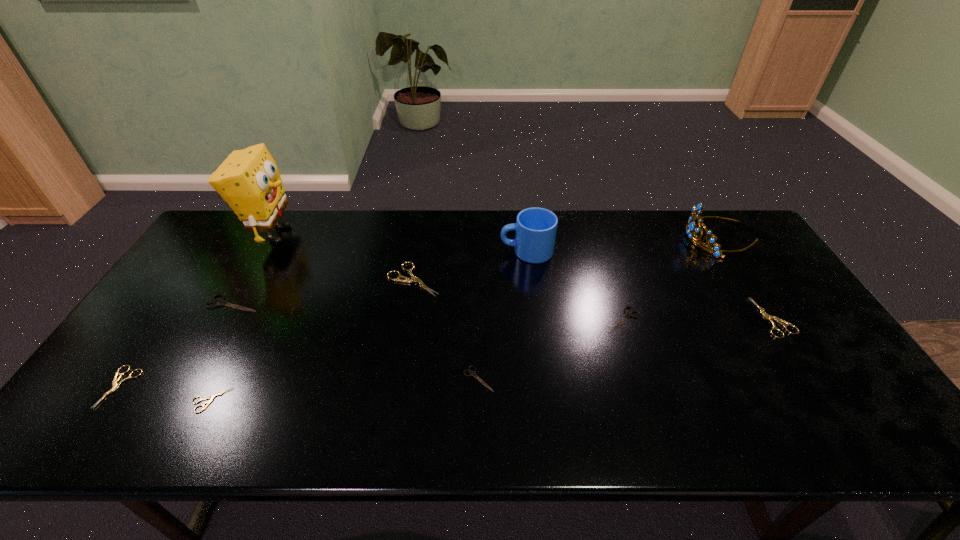
Find the location of a particular element. This screenshot has height=540, width=960. the rightmost shears is located at coordinates (770, 318).

I want to click on the leftmost shears, so click(115, 385).

The image size is (960, 540). I want to click on the leftmost beige shears, so click(115, 385).

Identify the location of the fifth object from right to left. (472, 373).

Locate an element on the screen. the nearest black shears is located at coordinates (472, 373).

Find the location of a particular element. The width and height of the screenshot is (960, 540). the shortest object is located at coordinates click(211, 398).

The height and width of the screenshot is (540, 960). I want to click on the third beige shears from right to left, so click(x=211, y=398).

You are a GUI agent. You are given a task and a screenshot of the screen. Output one action in this format:
    pyautogui.click(x=<x>, y=<y>)
    Task: Click on the vacant region located on the face of the sponge
    The height and width of the screenshot is (540, 960).
    Given the screenshot: What is the action you would take?
    pyautogui.click(x=376, y=234)

The height and width of the screenshot is (540, 960). In order to click on blank space located on the front-facing side of the tiara in this screenshot , I will do `click(626, 238)`.

What are the coordinates of `vacant space located 0.210m on the front-facing side of the tiara` in the screenshot? It's located at (623, 238).